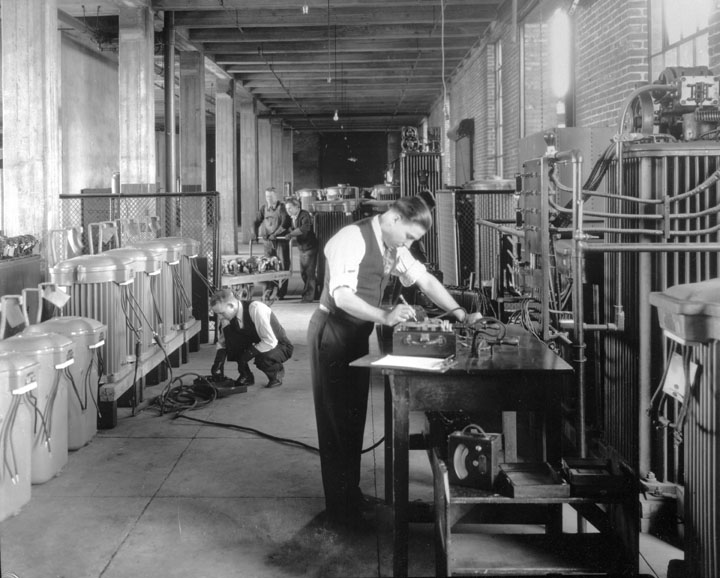
The width and height of the screenshot is (720, 578). Identify the location of beam. (251, 286).